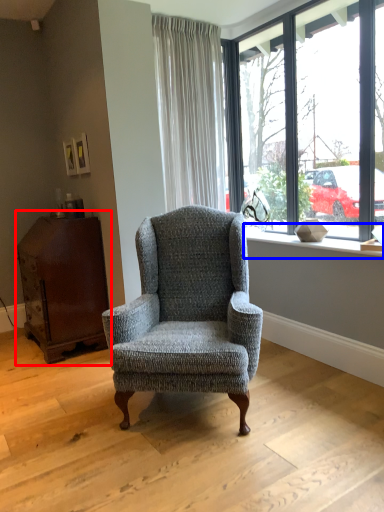
Question: Which of the following is the closest to the observer, dresser (highlighted by a red box) or window sill (highlighted by a blue box)?

Choices:
 (A) dresser
 (B) window sill

Answer: (B)